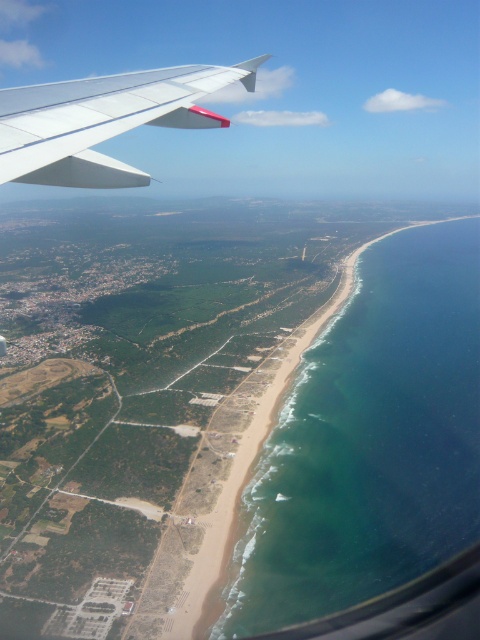
Which is behind, point (296, 616) or point (123, 168)?

Positioned behind is point (296, 616).

Can you confirm if green water at beach right is shorter than white matte wing at upper left?

Indeed, green water at beach right has a lesser height compared to white matte wing at upper left.

Is point (285, 461) in front of point (25, 129)?

That is False.

Find the location of a particular element. green water at beach right is located at coordinates (369, 442).